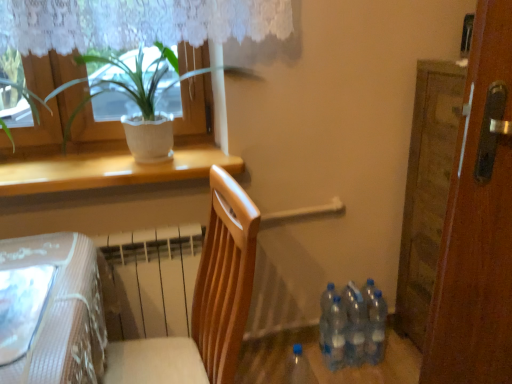
Describe the element at coordinates (298, 368) in the screenshot. I see `blue translucent bottle at lower center, the 1th bottle from the left` at that location.

From the picture: How much space does transparent plastic bottles at lower right, acting as the fifth bottle starting from the left, occupy horizontally?

It is 8.86 centimeters.

What do you see at coordinates (376, 328) in the screenshot?
I see `transparent plastic bottles at lower right, which is the 1th bottle in right-to-left order` at bounding box center [376, 328].

Locate an element on the screen. This screenshot has height=384, width=512. translucent plastic bottles at lower right, marked as the 2th bottle in a right-to-left arrangement is located at coordinates (354, 324).

Measure the distance between point (x=322, y=317) and camera.

A distance of 1.95 meters exists between point (x=322, y=317) and camera.

You are a GUI agent. You are given a task and a screenshot of the screen. Output one action in this format:
    pyautogui.click(x=<x>, y=<y>)
    Task: Click on the wooden chair at center
    
    Given the screenshot: What is the action you would take?
    pyautogui.click(x=203, y=303)

Describe the element at coordinates (478, 222) in the screenshot. I see `wooden door at right` at that location.

What do you see at coordinates (335, 335) in the screenshot? I see `transparent plastic bottles at lower right, which ranks as the third bottle in right-to-left order` at bounding box center [335, 335].

Identify the location of transparent plastic bottles at lower right, which ranks as the third bottle in right-to-left order. (335, 335).

The image size is (512, 384). In order to click on blue translucent bottle at lower center, the 1th bottle from the left in this screenshot , I will do `click(298, 368)`.

Is translucent plastic bottles at lower right, marked as the 2th bottle in a right-to-left arrangement, inside or outside of transparent plastic bottles at lower right, which is the 1th bottle in right-to-left order?

translucent plastic bottles at lower right, marked as the 2th bottle in a right-to-left arrangement, is outside transparent plastic bottles at lower right, which is the 1th bottle in right-to-left order.

Considering the sizes of objects translucent plastic bottles at lower right, marked as the 2th bottle in a right-to-left arrangement, and transparent plastic bottles at lower right, which is the 1th bottle in right-to-left order, in the image provided, who is wider, translucent plastic bottles at lower right, marked as the 2th bottle in a right-to-left arrangement, or transparent plastic bottles at lower right, which is the 1th bottle in right-to-left order,?

transparent plastic bottles at lower right, which is the 1th bottle in right-to-left order, is wider.

Between translucent plastic bottles at lower right, which is the 4th bottle from left to right, and transparent plastic bottles at lower right, which is the 1th bottle in right-to-left order, which one has larger size?

Answer: transparent plastic bottles at lower right, which is the 1th bottle in right-to-left order, is bigger.

Which is more to the right, translucent plastic bottles at lower right, marked as the 2th bottle in a right-to-left arrangement, or transparent plastic bottles at lower right, which is the 1th bottle in right-to-left order?

transparent plastic bottles at lower right, which is the 1th bottle in right-to-left order.

Are green leafy plant at upper left and wooden door at right located far from each other?

Absolutely, green leafy plant at upper left is distant from wooden door at right.

Between green leafy plant at upper left and wooden door at right, which one has smaller size?

green leafy plant at upper left is smaller.

From their relative heights in the image, would you say green leafy plant at upper left is taller or shorter than wooden door at right?

Clearly, green leafy plant at upper left is shorter compared to wooden door at right.

The image size is (512, 384). Find the location of `door below the green leafy plant at upper left (from the image's perspective)`. door below the green leafy plant at upper left (from the image's perspective) is located at coordinates (478, 222).

Does point (328, 310) come in front of point (236, 196)?

No.

Which of these two, transparent plastic bottles at lower right, arranged as the third bottle when viewed from the left, or wooden chair at center, stands taller?

wooden chair at center.

Which is in front, transparent plastic bottles at lower right, which ranks as the third bottle in right-to-left order, or wooden chair at center?

Positioned in front is wooden chair at center.

From the image's perspective, is white matte window sill at upper left above or below wooden door at right?

white matte window sill at upper left is above wooden door at right.

Would you say white matte window sill at upper left is inside or outside wooden door at right?

white matte window sill at upper left is spatially situated outside wooden door at right.

Is white matte window sill at upper left far from wooden door at right?

Yes.

This screenshot has height=384, width=512. In the image, there is a transparent plastic bottles at lower right, the 2th bottle positioned from the left. Find the location of `door above it (from the image's perspective)`. door above it (from the image's perspective) is located at coordinates (478, 222).

Considering the positions of objects transparent plastic bottles at lower right, the 2th bottle positioned from the left, and wooden door at right in the image provided, who is behind, transparent plastic bottles at lower right, the 2th bottle positioned from the left, or wooden door at right?

transparent plastic bottles at lower right, the 2th bottle positioned from the left.

Is transparent plastic bottles at lower right, the 2th bottle positioned from the left, at the left side of wooden door at right?

Yes.

Which object is wider, transparent plastic bottles at lower right, which is counted as the fourth bottle, starting from the right, or wooden door at right?

wooden door at right.

Is white matte window sill at upper left bigger than translucent plastic bottles at lower right, marked as the 2th bottle in a right-to-left arrangement?

Indeed, white matte window sill at upper left has a larger size compared to translucent plastic bottles at lower right, marked as the 2th bottle in a right-to-left arrangement.

Considering the relative sizes of white matte window sill at upper left and translucent plastic bottles at lower right, marked as the 2th bottle in a right-to-left arrangement, in the image provided, is white matte window sill at upper left thinner than translucent plastic bottles at lower right, marked as the 2th bottle in a right-to-left arrangement,?

In fact, white matte window sill at upper left might be wider than translucent plastic bottles at lower right, marked as the 2th bottle in a right-to-left arrangement.

Are white matte window sill at upper left and translucent plastic bottles at lower right, marked as the 2th bottle in a right-to-left arrangement, beside each other?

No, white matte window sill at upper left is not beside translucent plastic bottles at lower right, marked as the 2th bottle in a right-to-left arrangement.

From the image's perspective, starting from the green leafy plant at upper left, which bottle is the 2nd one below? Please provide its 2D coordinates.

[(376, 328)]

Between green leafy plant at upper left and transparent plastic bottles at lower right, acting as the fifth bottle starting from the left, which one is positioned in front?

green leafy plant at upper left is in front.

From the image's perspective, between green leafy plant at upper left and transparent plastic bottles at lower right, which is the 1th bottle in right-to-left order, who is located below?

transparent plastic bottles at lower right, which is the 1th bottle in right-to-left order.

Does green leafy plant at upper left turn towards transparent plastic bottles at lower right, acting as the fifth bottle starting from the left?

No, green leafy plant at upper left is not facing towards transparent plastic bottles at lower right, acting as the fifth bottle starting from the left.

In order to click on bottle above the transparent plastic bottles at lower right, acting as the fifth bottle starting from the left (from a real-world perspective) in this screenshot , I will do `click(354, 324)`.

You are a GUI agent. You are given a task and a screenshot of the screen. Output one action in this format:
    pyautogui.click(x=<x>, y=<y>)
    Task: Click on the door below the green leafy plant at upper left (from a real-world perspective)
    
    Given the screenshot: What is the action you would take?
    pyautogui.click(x=478, y=222)

Considering their positions, is wooden door at right positioned further to transparent plastic bottles at lower right, which is counted as the fourth bottle, starting from the right, than white matte window sill at upper left?

white matte window sill at upper left.

Estimate the real-world distances between objects in this image. Which object is further from transparent plastic bottles at lower right, which is the 1th bottle in right-to-left order, white matte window sill at upper left or transparent plastic bottles at lower right, which is counted as the fourth bottle, starting from the right?

white matte window sill at upper left is positioned further to the anchor transparent plastic bottles at lower right, which is the 1th bottle in right-to-left order.

Considering their positions, is transparent plastic bottles at lower right, which ranks as the third bottle in right-to-left order, positioned further to transparent plastic bottles at lower right, the 2th bottle positioned from the left, than wooden door at right?

Based on the image, wooden door at right appears to be further to transparent plastic bottles at lower right, the 2th bottle positioned from the left.

Based on their spatial positions, is translucent plastic bottles at lower right, marked as the 2th bottle in a right-to-left arrangement, or transparent plastic bottles at lower right, arranged as the third bottle when viewed from the left, closer to transparent plastic bottles at lower right, the 2th bottle positioned from the left?

transparent plastic bottles at lower right, arranged as the third bottle when viewed from the left.

Estimate the real-world distances between objects in this image. Which object is further from wooden chair at center, blue translucent bottle at lower center, placed as the 5th bottle when sorted from right to left, or white matte window sill at upper left?

blue translucent bottle at lower center, placed as the 5th bottle when sorted from right to left.

Considering their positions, is wooden door at right positioned closer to white matte window sill at upper left than transparent plastic bottles at lower right, which ranks as the third bottle in right-to-left order?

Based on the image, wooden door at right appears to be nearer to white matte window sill at upper left.

Estimate the real-world distances between objects in this image. Which object is closer to blue translucent bottle at lower center, placed as the 5th bottle when sorted from right to left, translucent plastic bottles at lower right, which is the 4th bottle from left to right, or wooden door at right?

Based on the image, translucent plastic bottles at lower right, which is the 4th bottle from left to right, appears to be nearer to blue translucent bottle at lower center, placed as the 5th bottle when sorted from right to left.

Based on the photo, considering their positions, is wooden door at right positioned further to wooden chair at center than blue translucent bottle at lower center, the 1th bottle from the left?

blue translucent bottle at lower center, the 1th bottle from the left, lies further to wooden chair at center than the other object.

At what (x,y) coordinates should I click in order to perform the action: click on bottle between white matte window sill at upper left and transparent plastic bottles at lower right, which is counted as the fourth bottle, starting from the right. Please return your answer as a coordinate pair (x, y). The width and height of the screenshot is (512, 384). Looking at the image, I should click on (298, 368).

At what (x,y) coordinates should I click in order to perform the action: click on window sill between wooden chair at center and transparent plastic bottles at lower right, which is counted as the fourth bottle, starting from the right, from front to back. Please return your answer as a coordinate pair (x, y). This screenshot has height=384, width=512. Looking at the image, I should click on click(108, 168).

You are a GUI agent. You are given a task and a screenshot of the screen. Output one action in this format:
    pyautogui.click(x=<x>, y=<y>)
    Task: Click on the window sill between green leafy plant at upper left and blue translucent bottle at lower center, placed as the 5th bottle when sorted from right to left, from top to bottom
    
    Given the screenshot: What is the action you would take?
    pyautogui.click(x=108, y=168)

The width and height of the screenshot is (512, 384). Find the location of `houseplant between wooden chair at center and transparent plastic bottles at lower right, which ranks as the third bottle in right-to-left order, in the front-back direction`. houseplant between wooden chair at center and transparent plastic bottles at lower right, which ranks as the third bottle in right-to-left order, in the front-back direction is located at coordinates (51, 119).